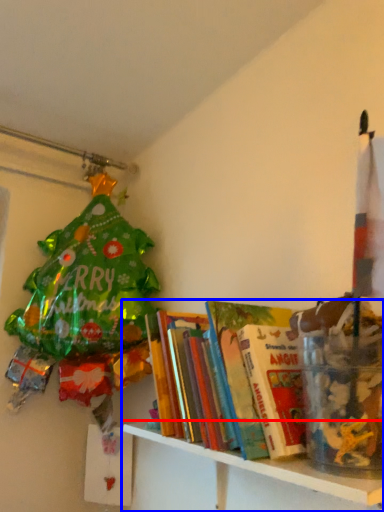
Question: Among these objects, which one is farthest to the camera, shelf (highlighted by a red box) or shelf (highlighted by a blue box)?

Choices:
 (A) shelf
 (B) shelf

Answer: (B)